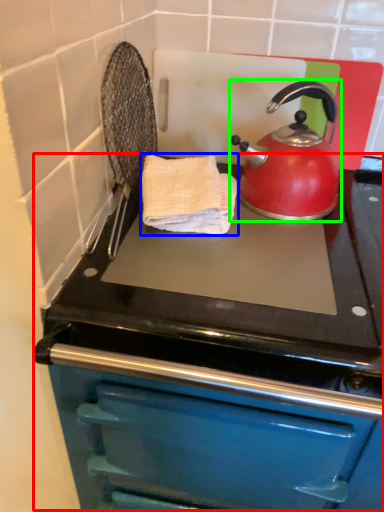
Question: Considering the real-world distances, which object is farthest from oven (highlighted by a red box)? hand towel (highlighted by a blue box) or kettle (highlighted by a green box)?

Choices:
 (A) hand towel
 (B) kettle

Answer: (B)